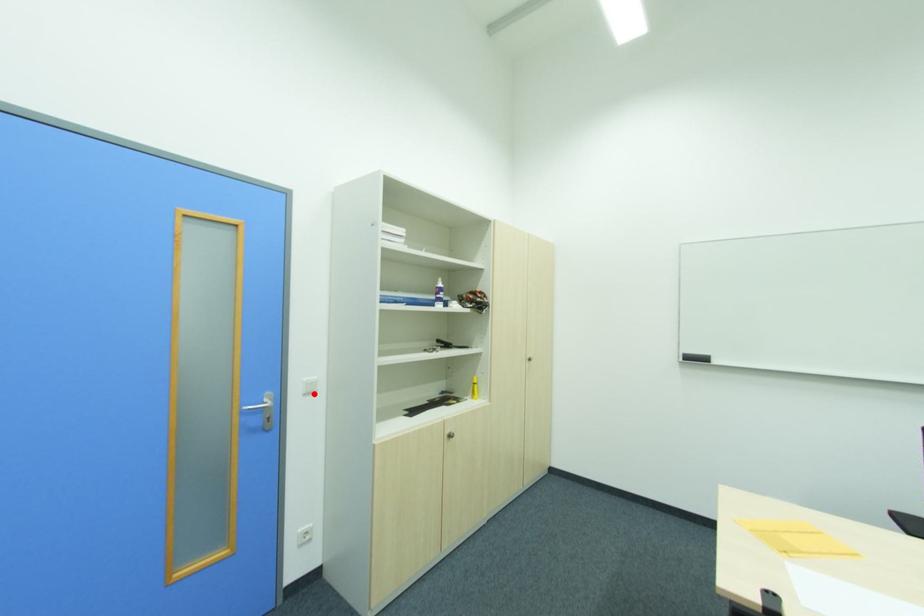
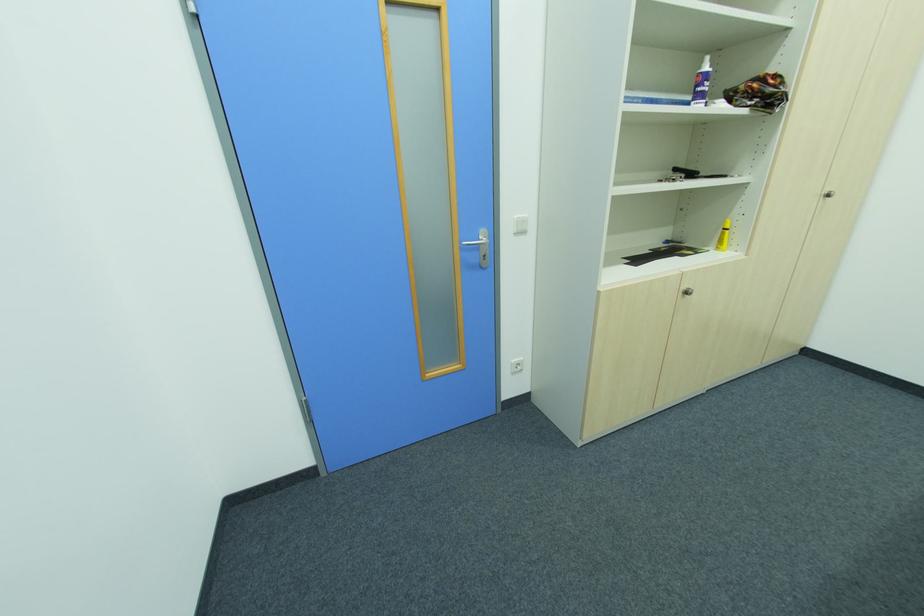
In the second image, find the point that corresponds to the highlighted location in the first image.

(525, 233)